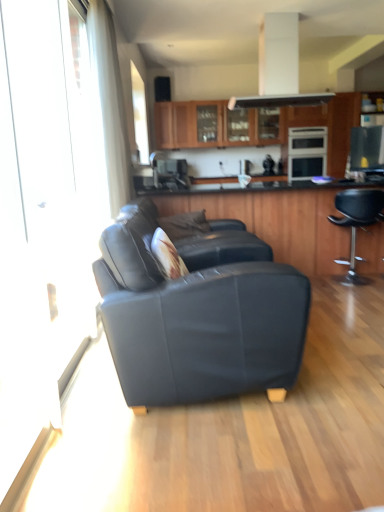
I want to click on vacant space in front of matte black couch at center, so click(x=231, y=450).